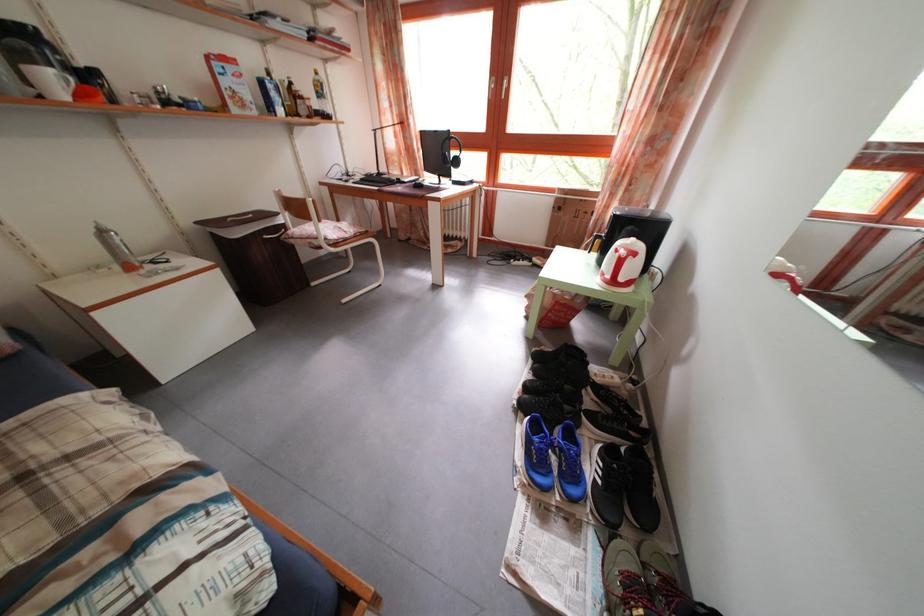
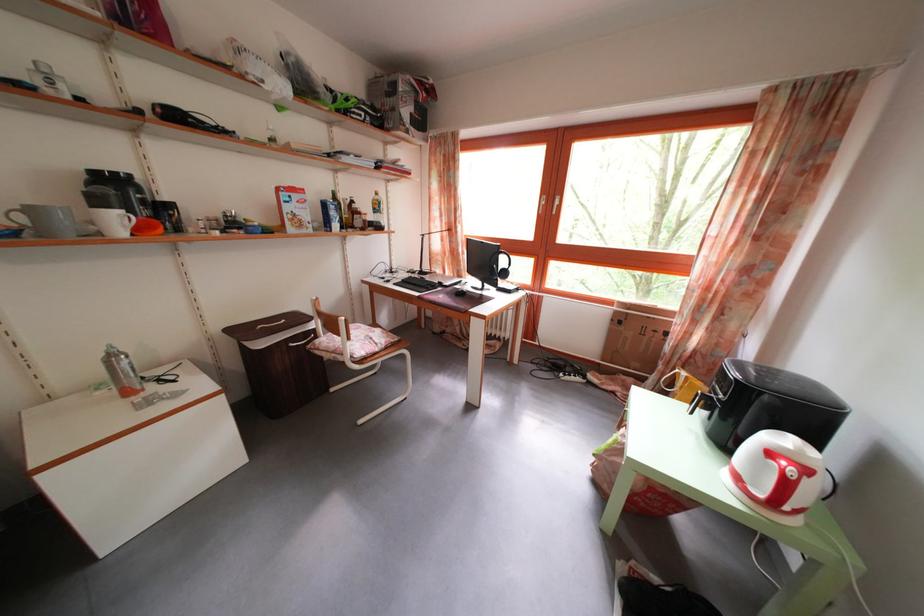
Locate, in the second image, the point that corresponds to (277,92) in the first image.

(338, 214)